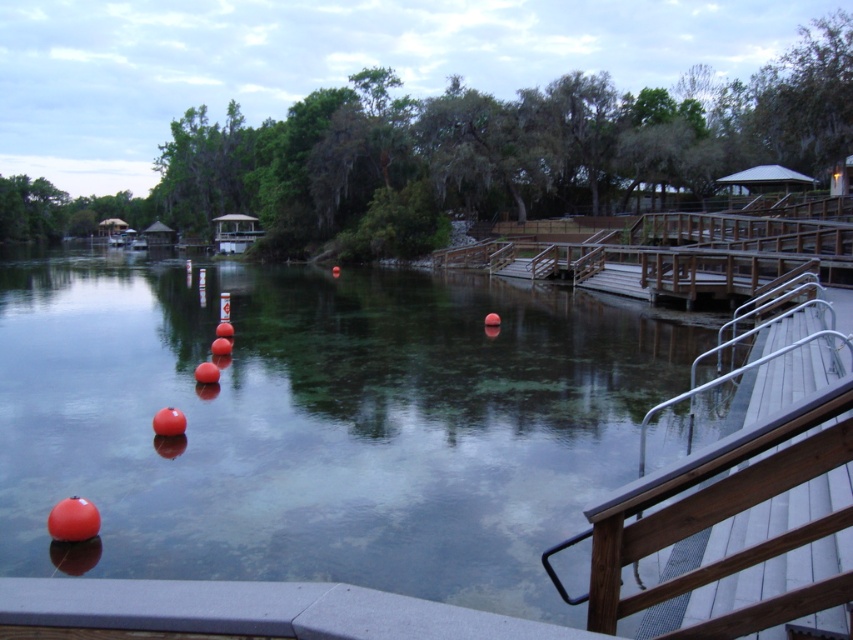
Is point (48, 481) farther from camera compared to point (636, 566)?

That is True.

Locate an element on the screen. This screenshot has height=640, width=853. transparent water at center is located at coordinates (320, 420).

Is point (102, 392) farther from viewer compared to point (849, 412)?

Yes.

Identify the location of transparent water at center. This screenshot has height=640, width=853. (320, 420).